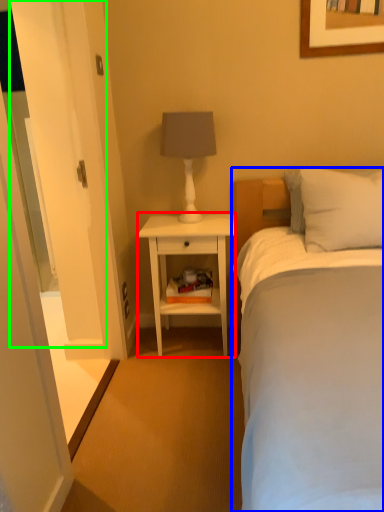
Question: Which object is positioned farthest from nightstand (highlighted by a red box)? Select from bed (highlighted by a blue box) and glass door (highlighted by a green box).

Choices:
 (A) bed
 (B) glass door

Answer: (A)